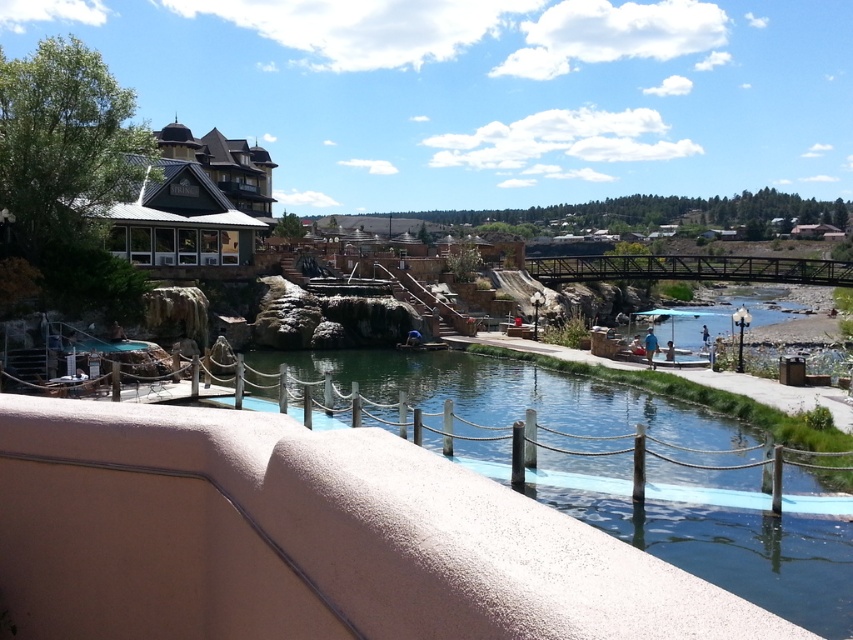
Question: Among these objects, which one is nearest to the camera?

Choices:
 (A) smooth concrete river at center
 (B) green shingles at upper left

Answer: (A)

Question: Which point is farther from the camera taking this photo?

Choices:
 (A) (630, 266)
 (B) (784, 600)
 (C) (112, 220)

Answer: (A)

Question: Among these points, which one is nearest to the camera?

Choices:
 (A) (709, 262)
 (B) (187, 252)

Answer: (B)

Question: Is smooth concrete river at center to the right of green shingles at upper left from the viewer's perspective?

Choices:
 (A) no
 (B) yes

Answer: (B)

Question: Is smooth concrete river at center behind green shingles at upper left?

Choices:
 (A) yes
 (B) no

Answer: (B)

Question: Can you confirm if smooth concrete river at center is positioned to the right of black metal bridge at center?

Choices:
 (A) yes
 (B) no

Answer: (B)